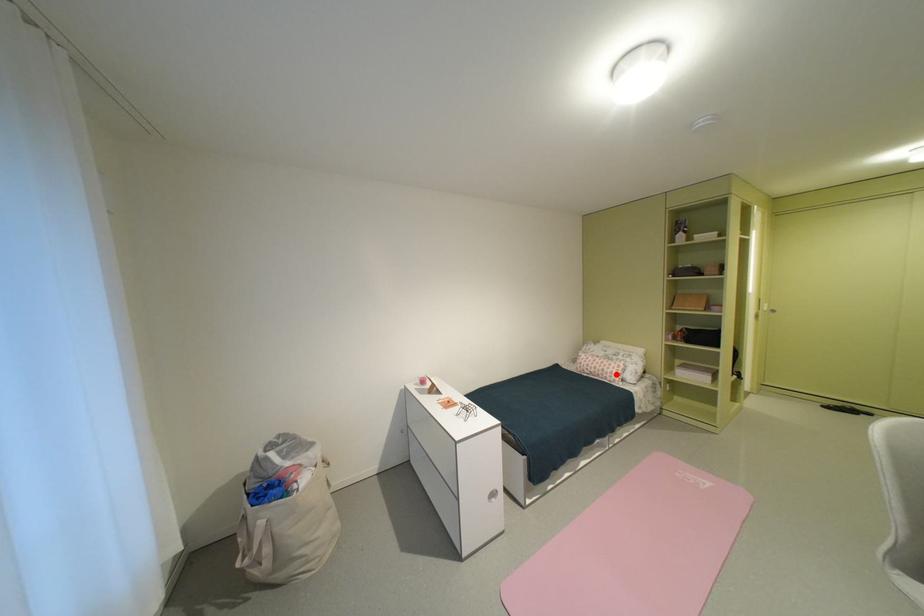
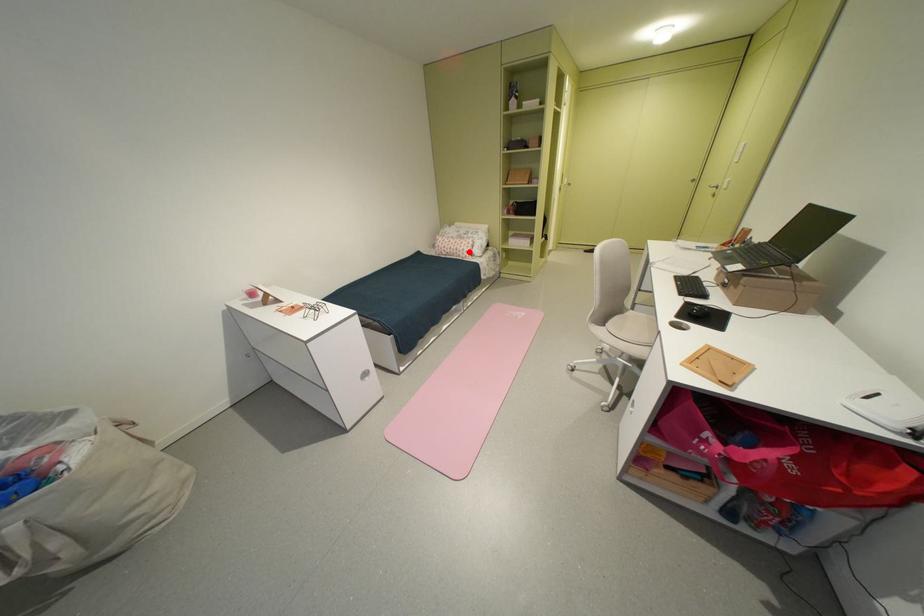
I am providing you with two images of the same scene from different viewpoints. A red point is marked on the first image and another point is marked on the second image. Does the point marked in image1 correspond to the same location as the one in image2?

Yes